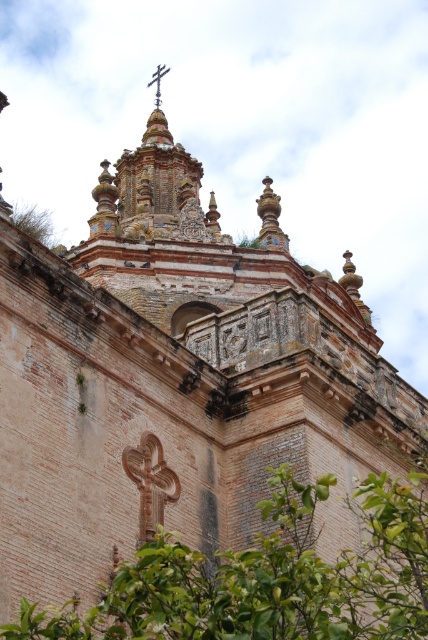
From the picture: Is green leafy tree at center closer to camera compared to green leafy tree at upper left?

Yes, it is in front of green leafy tree at upper left.

Is point (27, 602) less distant than point (44, 220)?

Yes, point (27, 602) is closer to viewer.

Is point (186, 636) behind point (23, 224)?

No, it is not.

Find the location of `green leafy tree at center`. green leafy tree at center is located at coordinates (269, 577).